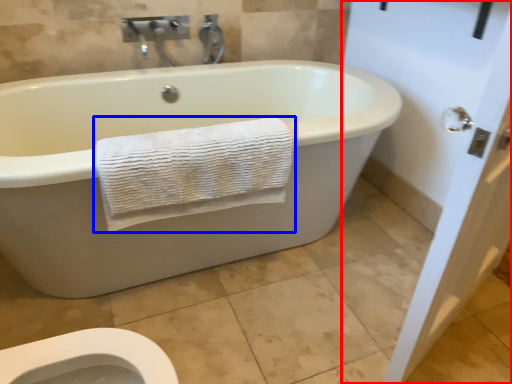
Question: Among these objects, which one is nearest to the camera, screen door (highlighted by a red box) or towel (highlighted by a blue box)?

Choices:
 (A) screen door
 (B) towel

Answer: (A)